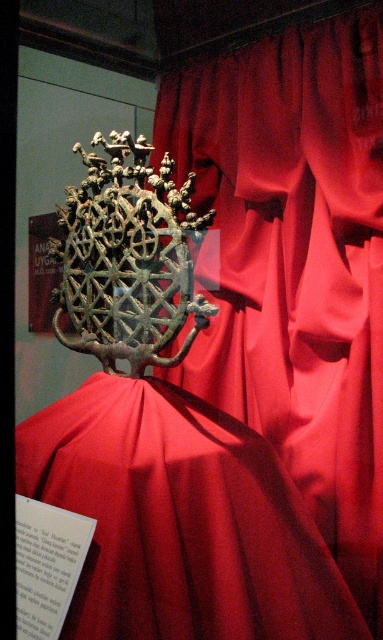
Between satin red curtain at center and satin red dress at center, which one appears on the right side from the viewer's perspective?

Positioned to the right is satin red curtain at center.

Between satin red curtain at center and satin red dress at center, which one has less height?

Standing shorter between the two is satin red dress at center.

At what (x,y) coordinates should I click in order to perform the action: click on satin red curtain at center. Please return your answer as a coordinate pair (x, y). Looking at the image, I should click on (296, 262).

At what (x,y) coordinates should I click in order to perform the action: click on satin red curtain at center. Please return your answer as a coordinate pair (x, y). Looking at the image, I should click on (296, 262).